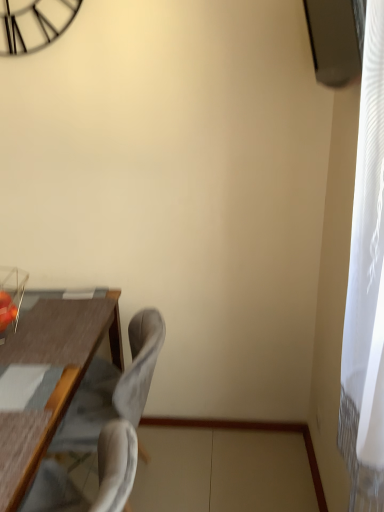
Where is `vacant area on top of suede-like gray chair at center-left (from a real-world perspective)`? This screenshot has width=384, height=512. vacant area on top of suede-like gray chair at center-left (from a real-world perspective) is located at coordinates (57, 331).